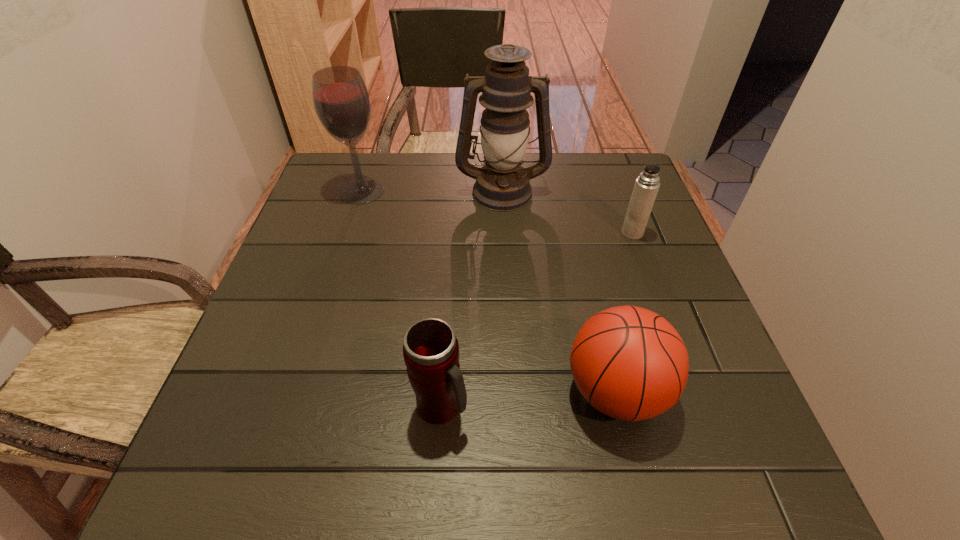
This screenshot has height=540, width=960. In order to click on free region at the left edge of the desktop in this screenshot , I will do `click(330, 269)`.

The image size is (960, 540). In order to click on vacant space at the right edge of the desktop in this screenshot , I will do `click(708, 362)`.

Where is `vacant space at the far left corner of the desktop`? This screenshot has height=540, width=960. vacant space at the far left corner of the desktop is located at coordinates (337, 184).

I want to click on free space at the near left corner, so click(x=226, y=474).

The height and width of the screenshot is (540, 960). In the image, there is a desktop. What are the coordinates of `vacant space at the far right corner` in the screenshot? It's located at (583, 176).

Where is `empty space between the second tallest object and the basketball`? The width and height of the screenshot is (960, 540). empty space between the second tallest object and the basketball is located at coordinates 489,291.

I want to click on vacant space in between the left thermos bottle and the farther thermos bottle, so click(x=537, y=320).

Where is `empty space between the tallest object and the rightmost object`? empty space between the tallest object and the rightmost object is located at coordinates (567, 212).

What are the coordinates of `free spot between the alcohol and the tallest object` in the screenshot? It's located at (432, 191).

I want to click on free spot between the second tallest object and the rightmost object, so click(x=497, y=212).